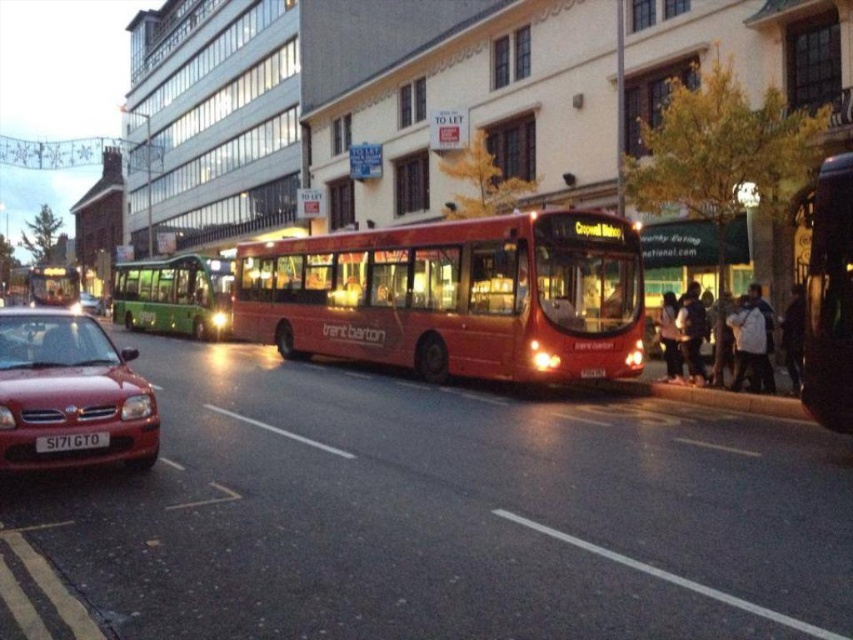
You are a pedestrian standing at the bus stop and want to cross the street safely. The black plastic license plate at center and the metallic red car at left are in your line of sight. Which object should you pay closer attention to while crossing?

The black plastic license plate at center is in front of the metallic red car at left, so you should pay closer attention to the metallic red car at left while crossing the street because it is closer to you.